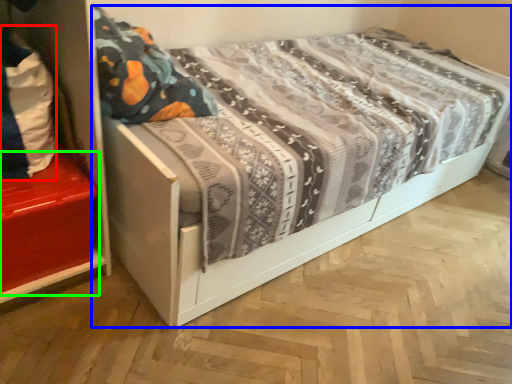
Question: Based on their relative distances, which object is nearer to material (highlighted by a red box)? Choose from bed (highlighted by a blue box) and shelf (highlighted by a green box).

Choices:
 (A) bed
 (B) shelf

Answer: (B)